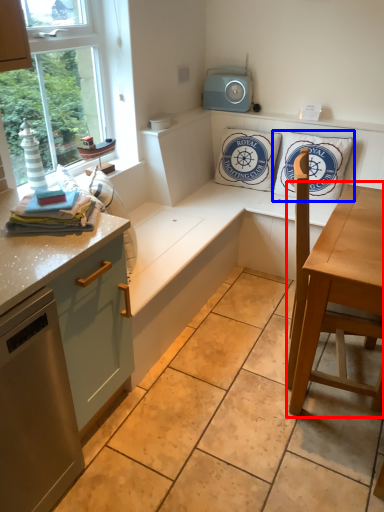
Question: Among these objects, which one is farthest to the camera, table (highlighted by a red box) or pillow (highlighted by a blue box)?

Choices:
 (A) table
 (B) pillow

Answer: (B)